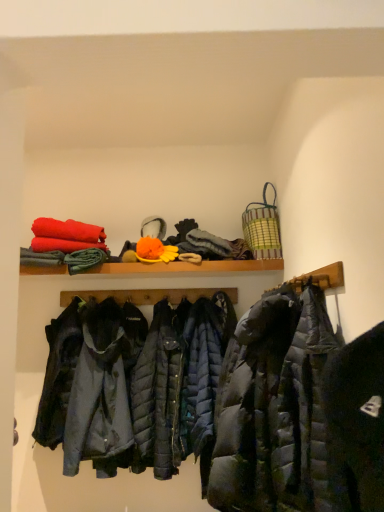
Question: Is point [39, 272] positioned closer to the camera than point [266, 202]?

Choices:
 (A) farther
 (B) closer

Answer: (B)

Question: Is wooden shelf at upper center spatially inside green striped woven basket at upper right, or outside of it?

Choices:
 (A) outside
 (B) inside

Answer: (A)

Question: Which of these objects is positioned farthest from the dark gray quilted jacket at center?

Choices:
 (A) wooden shelf at upper center
 (B) green striped woven basket at upper right

Answer: (A)

Question: Which of these objects is positioned farthest from the wooden shelf at upper center?

Choices:
 (A) green striped woven basket at upper right
 (B) dark gray quilted jacket at center

Answer: (B)